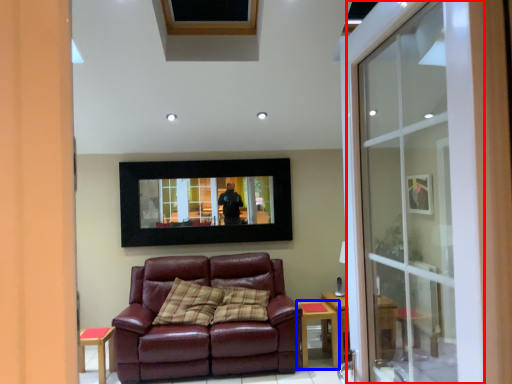
Question: Which object is further to the camera taking this photo, screen door (highlighted by a red box) or table (highlighted by a blue box)?

Choices:
 (A) screen door
 (B) table

Answer: (B)